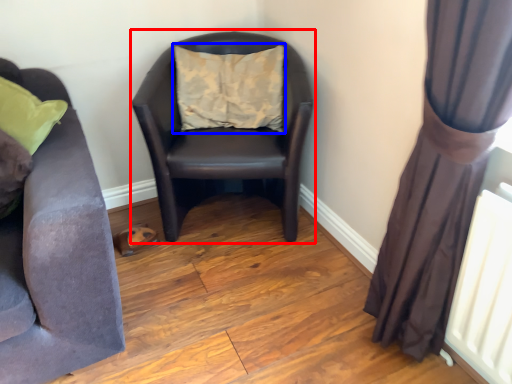
Question: Among these objects, which one is farthest to the camera, rocking chair (highlighted by a red box) or pillow (highlighted by a blue box)?

Choices:
 (A) rocking chair
 (B) pillow

Answer: (B)